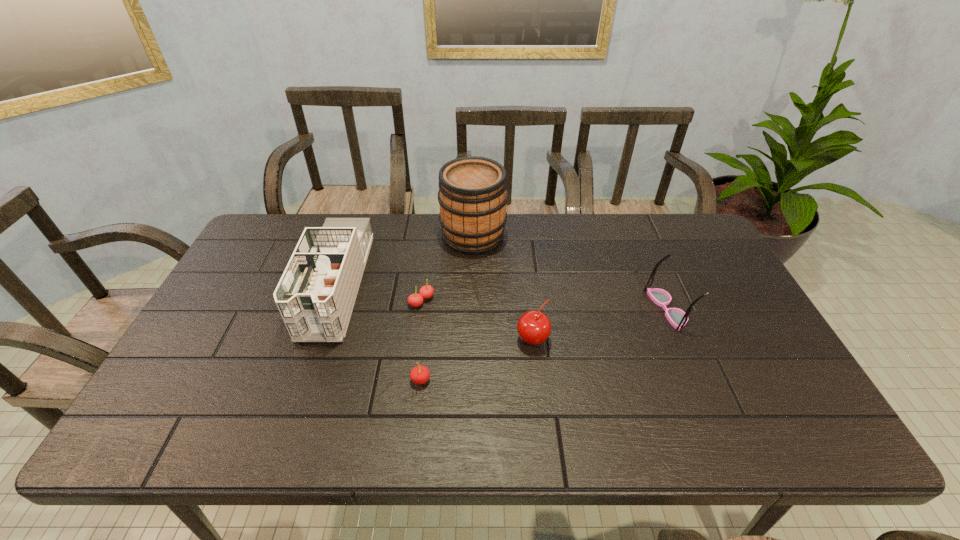
At what (x,y) coordinates should I click in order to perform the action: click on cider. Please return your answer as a coordinate pair (x, y). The width and height of the screenshot is (960, 540). Looking at the image, I should click on (472, 194).

The width and height of the screenshot is (960, 540). In order to click on the leftmost object in this screenshot , I will do `click(315, 296)`.

The height and width of the screenshot is (540, 960). In order to click on the fifth shortest object in this screenshot , I will do `click(315, 296)`.

At what (x,y) coordinates should I click in order to perform the action: click on spectacles. Please return your answer as a coordinate pair (x, y). Looking at the image, I should click on point(677,318).

Identify the location of the rightmost object. Image resolution: width=960 pixels, height=540 pixels. (677, 318).

Identify the location of the tallest cherry. (534, 327).

Where is `the second nearest cherry`? This screenshot has width=960, height=540. the second nearest cherry is located at coordinates 534,327.

Image resolution: width=960 pixels, height=540 pixels. I want to click on the second tallest cherry, so click(420, 374).

In order to click on the fifth tallest object in this screenshot , I will do `click(420, 374)`.

The width and height of the screenshot is (960, 540). In order to click on the shortest object in this screenshot , I will do (x=426, y=291).